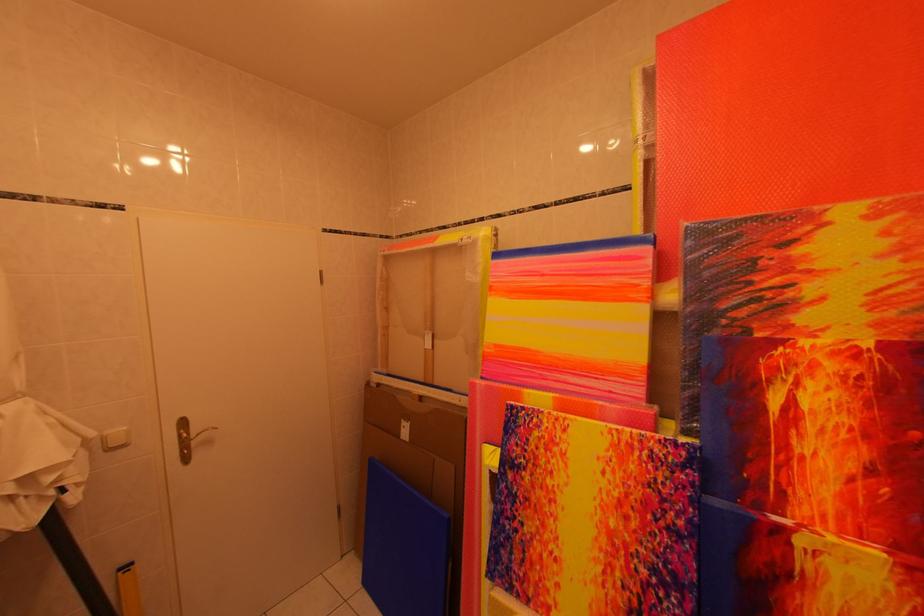
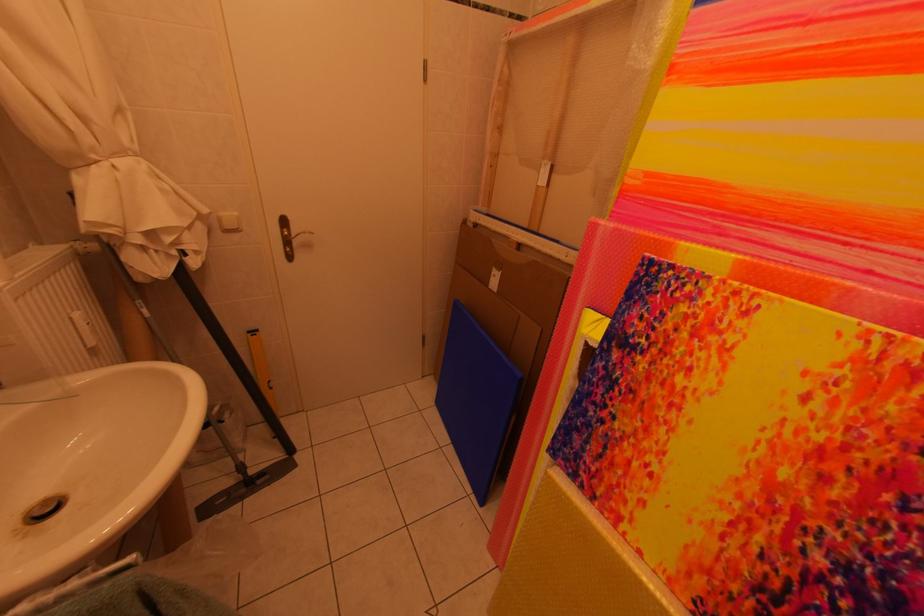
Where in the second image is the point corresponding to (361,556) from the first image?

(442, 379)